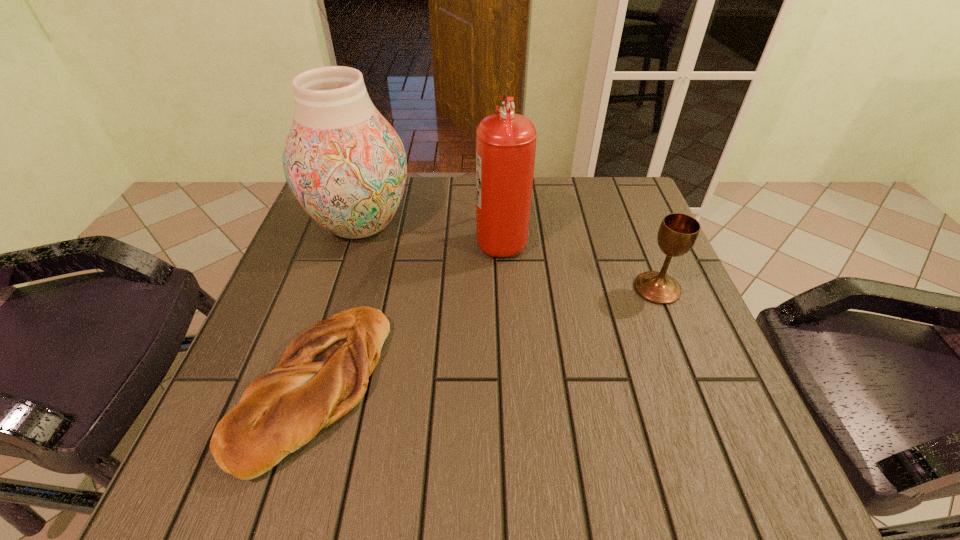
You are a GUI agent. You are given a task and a screenshot of the screen. Output one action in this format:
    pyautogui.click(x=<x>, y=<y>)
    Task: Click on the free location located on the back of the chalice
    
    Given the screenshot: What is the action you would take?
    pyautogui.click(x=613, y=181)

At what (x,y) coordinates should I click in order to perform the action: click on blank area located 0.240m on the right of the nearest object. Please return your answer as a coordinate pair (x, y). This screenshot has width=960, height=540. Looking at the image, I should click on (518, 386).

Locate an element on the screen. Image resolution: width=960 pixels, height=540 pixels. fire extinguisher that is at the far edge is located at coordinates (505, 142).

The image size is (960, 540). I want to click on vase that is at the far edge, so click(345, 164).

Identify the location of object at the near edge. (323, 374).

In order to click on vase that is at the left edge in this screenshot , I will do `click(345, 164)`.

I want to click on bread present at the left edge, so click(323, 374).

This screenshot has height=540, width=960. What are the coordinates of `object at the right edge` in the screenshot? It's located at (678, 233).

You are a GUI agent. You are given a task and a screenshot of the screen. Output one action in this format:
    pyautogui.click(x=<x>, y=<y>)
    Task: Click on the object that is at the far left corner
    
    Given the screenshot: What is the action you would take?
    pyautogui.click(x=345, y=164)

Find the location of a particular element. The image size is (960, 540). object that is at the near left corner is located at coordinates point(323,374).